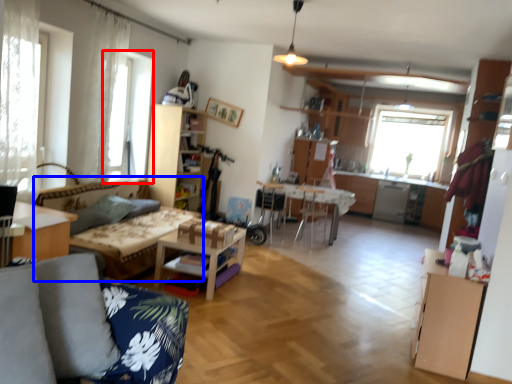
Question: Which of the following is the farthest to the observer, window (highlighted by a red box) or couch (highlighted by a blue box)?

Choices:
 (A) window
 (B) couch

Answer: (A)